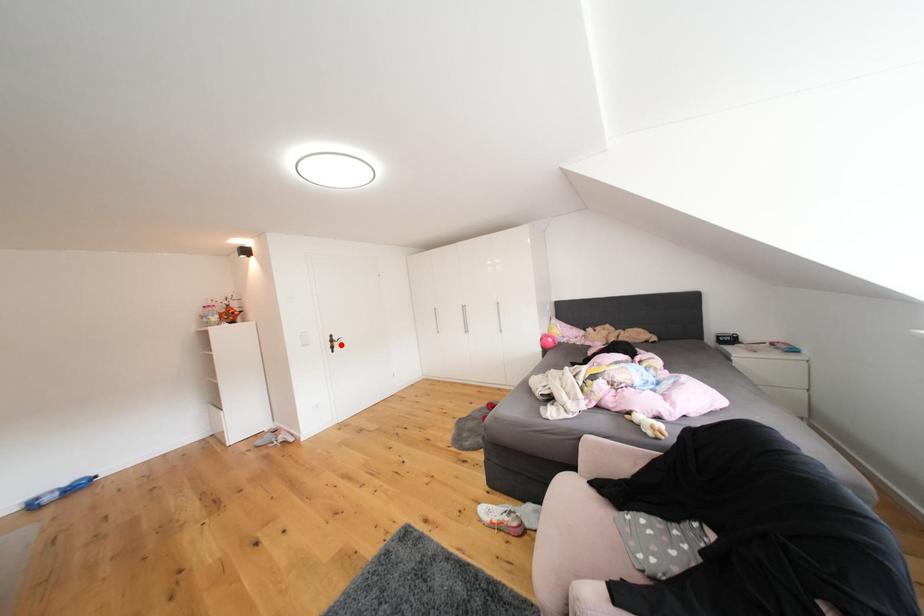
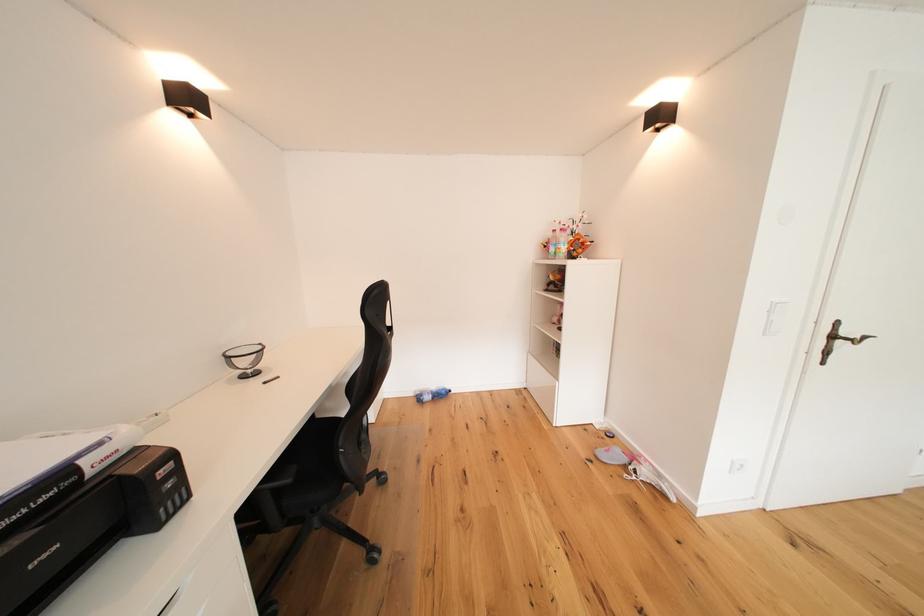
Locate, in the second image, the point that corresponds to the highlighted location in the first image.

(843, 339)